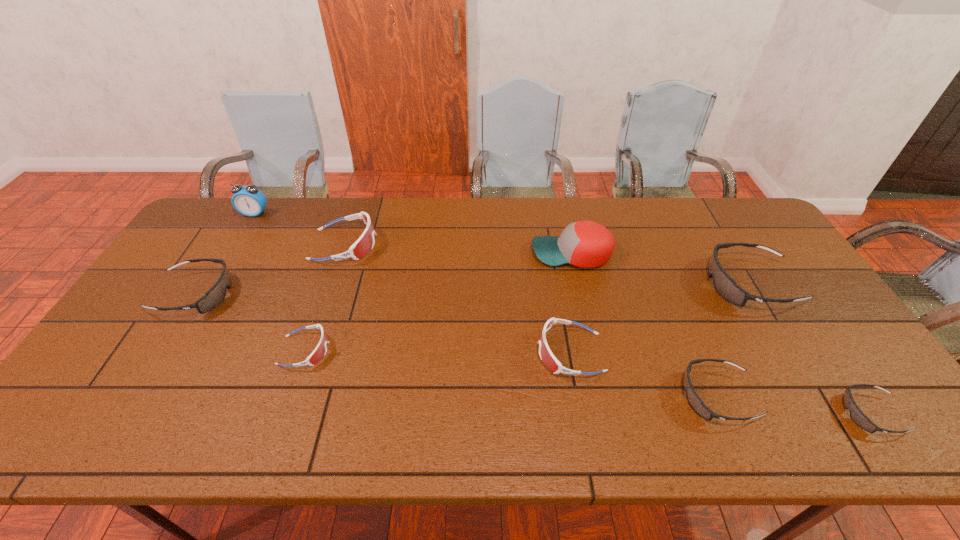
Where is `free space at the near edge`? The width and height of the screenshot is (960, 540). free space at the near edge is located at coordinates (649, 436).

Locate an element on the screen. This screenshot has width=960, height=540. vacant space at the left edge is located at coordinates (76, 402).

You are a GUI agent. You are given a task and a screenshot of the screen. Output one action in this format:
    pyautogui.click(x=<x>, y=<y>)
    Task: Click on the vacant space at the right edge of the desktop
    The width and height of the screenshot is (960, 540).
    Given the screenshot: What is the action you would take?
    pyautogui.click(x=767, y=311)

I want to click on vacant space at the far left corner of the desktop, so pyautogui.click(x=229, y=217).

Locate an element on the screen. The width and height of the screenshot is (960, 540). unoccupied position between the leftmost black goggles and the farthest red goggles is located at coordinates (270, 269).

The width and height of the screenshot is (960, 540). Find the location of `free point between the third smallest black goggles and the second black goggles from left to right`. free point between the third smallest black goggles and the second black goggles from left to right is located at coordinates (456, 346).

You are a GUI agent. You are given a task and a screenshot of the screen. Output one action in this format:
    pyautogui.click(x=<x>, y=<y>)
    Task: Click on the free spot between the smallest black goggles and the leftmost black goggles
    The width and height of the screenshot is (960, 540).
    Given the screenshot: What is the action you would take?
    pyautogui.click(x=534, y=354)

Where is `vacant region between the shortest goggles and the third goggles from right to left`? The image size is (960, 540). vacant region between the shortest goggles and the third goggles from right to left is located at coordinates coord(794,405).

Find the location of a particular element. free spot between the alarm clock and the smallest red goggles is located at coordinates (280, 282).

Where is `vacant point located between the second black goggles from left to right and the baseball cap`? vacant point located between the second black goggles from left to right and the baseball cap is located at coordinates pos(644,325).